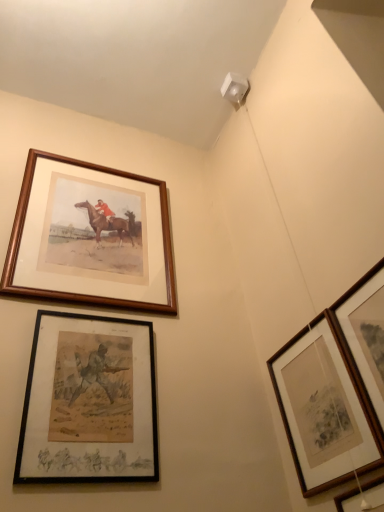
What do you see at coordinates (365, 335) in the screenshot?
I see `wooden picture frame at upper right, marked as the fifth picture frame in a left-to-right arrangement` at bounding box center [365, 335].

Image resolution: width=384 pixels, height=512 pixels. Describe the element at coordinates (348, 499) in the screenshot. I see `wooden picture frame at lower right, arranged as the second picture frame when viewed from the right` at that location.

What is the approximate width of wooden framed print at lower right, which is the third picture frame in right-to-left order?

It is 1.67 inches.

Image resolution: width=384 pixels, height=512 pixels. What are the coordinates of `black matte picture frame at lower left, which is the 2th picture frame from left to right` in the screenshot? It's located at (89, 402).

Considering the sizes of objects wooden framed print at lower right, which appears as the 3th picture frame when viewed from the left, and wooden picture frame at lower right, the 4th picture frame viewed from the left, in the image provided, who is thinner, wooden framed print at lower right, which appears as the 3th picture frame when viewed from the left, or wooden picture frame at lower right, the 4th picture frame viewed from the left,?

Thinner between the two is wooden framed print at lower right, which appears as the 3th picture frame when viewed from the left.

Is wooden framed print at lower right, which appears as the 3th picture frame when viewed from the left, facing away from wooden picture frame at lower right, the 4th picture frame viewed from the left?

wooden framed print at lower right, which appears as the 3th picture frame when viewed from the left, is not turned away from wooden picture frame at lower right, the 4th picture frame viewed from the left.

Does wooden framed print at lower right, which is the third picture frame in right-to-left order, have a lesser height compared to wooden picture frame at lower right, arranged as the second picture frame when viewed from the right?

No, wooden framed print at lower right, which is the third picture frame in right-to-left order, is not shorter than wooden picture frame at lower right, arranged as the second picture frame when viewed from the right.

Is wooden picture frame at lower right, the 4th picture frame viewed from the left, oriented away from wooden picture frame at upper right, marked as the fifth picture frame in a left-to-right arrangement?

That's not correct — wooden picture frame at lower right, the 4th picture frame viewed from the left, is not looking away from wooden picture frame at upper right, marked as the fifth picture frame in a left-to-right arrangement.

This screenshot has width=384, height=512. I want to click on picture frame below the wooden picture frame at upper right, marked as the first picture frame in a right-to-left arrangement (from a real-world perspective), so click(348, 499).

Does point (379, 502) come farther from viewer compared to point (378, 406)?

That is False.

From the image's perspective, which object appears higher, wooden picture frame at lower right, the 4th picture frame viewed from the left, or wooden picture frame at upper right, marked as the fifth picture frame in a left-to-right arrangement?

wooden picture frame at upper right, marked as the fifth picture frame in a left-to-right arrangement.

Is wooden picture frame at lower right, arranged as the second picture frame when viewed from the right, thinner than black matte picture frame at lower left, which is the 2th picture frame from left to right?

No, wooden picture frame at lower right, arranged as the second picture frame when viewed from the right, is not thinner than black matte picture frame at lower left, which is the 2th picture frame from left to right.

In the scene shown: Does wooden picture frame at lower right, the 4th picture frame viewed from the left, have a smaller size compared to black matte picture frame at lower left, which ranks as the 4th picture frame in right-to-left order?

Actually, wooden picture frame at lower right, the 4th picture frame viewed from the left, might be larger than black matte picture frame at lower left, which ranks as the 4th picture frame in right-to-left order.

Is wooden picture frame at lower right, the 4th picture frame viewed from the left, far from black matte picture frame at lower left, which is the 2th picture frame from left to right?

No, wooden picture frame at lower right, the 4th picture frame viewed from the left, is in close proximity to black matte picture frame at lower left, which is the 2th picture frame from left to right.

Is wooden picture frame at lower right, arranged as the second picture frame when viewed from the right, oriented away from black matte picture frame at lower left, which ranks as the 4th picture frame in right-to-left order?

wooden picture frame at lower right, arranged as the second picture frame when viewed from the right, is not turned away from black matte picture frame at lower left, which ranks as the 4th picture frame in right-to-left order.

Which point is more distant from viewer, [343,435] or [69,211]?

The point [69,211] is farther from the camera.

Considering their positions, is wooden framed print at lower right, which appears as the 3th picture frame when viewed from the left, located in front of or behind wooden frame at upper left, the fifth picture frame in the right-to-left sequence?

Clearly, wooden framed print at lower right, which appears as the 3th picture frame when viewed from the left, is in front of wooden frame at upper left, the fifth picture frame in the right-to-left sequence.

Which picture frame is the 2nd one when counting from the back of the wooden framed print at lower right, which appears as the 3th picture frame when viewed from the left? Please provide its 2D coordinates.

[(90, 237)]

Is wooden framed print at lower right, which is the third picture frame in right-to-left order, spatially inside wooden frame at upper left, which appears as the first picture frame when viewed from the left, or outside of it?

wooden framed print at lower right, which is the third picture frame in right-to-left order, is outside wooden frame at upper left, which appears as the first picture frame when viewed from the left.

Considering the points (351, 347) and (132, 226), which point is in front, point (351, 347) or point (132, 226)?

The point (351, 347) is in front.

Could you tell me if wooden picture frame at upper right, marked as the first picture frame in a right-to-left arrangement, is turned towards wooden frame at upper left, which appears as the first picture frame when viewed from the left?

No, wooden picture frame at upper right, marked as the first picture frame in a right-to-left arrangement, is not oriented towards wooden frame at upper left, which appears as the first picture frame when viewed from the left.

From the image's perspective, would you say wooden picture frame at upper right, marked as the fifth picture frame in a left-to-right arrangement, is shown under wooden frame at upper left, which appears as the first picture frame when viewed from the left?

Indeed, from the image's perspective, wooden picture frame at upper right, marked as the fifth picture frame in a left-to-right arrangement, is shown beneath wooden frame at upper left, which appears as the first picture frame when viewed from the left.

Find the location of `picture frame that is the 3rd object located in front of the wooden frame at upper left, which appears as the first picture frame when viewed from the left`. picture frame that is the 3rd object located in front of the wooden frame at upper left, which appears as the first picture frame when viewed from the left is located at coordinates (365, 335).

Which point is more distant from viewer, (356, 497) or (281, 378)?

The point (281, 378) is behind.

Looking at their sizes, would you say wooden picture frame at lower right, the 4th picture frame viewed from the left, is wider or thinner than wooden framed print at lower right, which is the third picture frame in right-to-left order?

In the image, wooden picture frame at lower right, the 4th picture frame viewed from the left, appears to be wider than wooden framed print at lower right, which is the third picture frame in right-to-left order.

From a real-world perspective, who is located higher, wooden picture frame at lower right, the 4th picture frame viewed from the left, or wooden framed print at lower right, which is the third picture frame in right-to-left order?

wooden framed print at lower right, which is the third picture frame in right-to-left order, is physically above.

Considering the relative sizes of wooden picture frame at lower right, arranged as the second picture frame when viewed from the right, and wooden framed print at lower right, which is the third picture frame in right-to-left order, in the image provided, is wooden picture frame at lower right, arranged as the second picture frame when viewed from the right, taller than wooden framed print at lower right, which is the third picture frame in right-to-left order,?

In fact, wooden picture frame at lower right, arranged as the second picture frame when viewed from the right, may be shorter than wooden framed print at lower right, which is the third picture frame in right-to-left order.

From the image's perspective, is wooden picture frame at upper right, marked as the first picture frame in a right-to-left arrangement, above wooden picture frame at lower right, arranged as the second picture frame when viewed from the right?

Indeed, from the image's perspective, wooden picture frame at upper right, marked as the first picture frame in a right-to-left arrangement, is shown above wooden picture frame at lower right, arranged as the second picture frame when viewed from the right.

Which of these two, wooden picture frame at upper right, marked as the fifth picture frame in a left-to-right arrangement, or wooden picture frame at lower right, the 4th picture frame viewed from the left, is smaller?

wooden picture frame at upper right, marked as the fifth picture frame in a left-to-right arrangement.

At what (x,y) coordinates should I click in order to perform the action: click on the 1st picture frame directly above the wooden picture frame at lower right, the 4th picture frame viewed from the left (from a real-world perspective). Please return your answer as a coordinate pair (x, y). Looking at the image, I should click on (365, 335).

Would you say wooden picture frame at upper right, marked as the fifth picture frame in a left-to-right arrangement, is inside or outside wooden picture frame at lower right, arranged as the second picture frame when viewed from the right?

Result: wooden picture frame at upper right, marked as the fifth picture frame in a left-to-right arrangement, is outside wooden picture frame at lower right, arranged as the second picture frame when viewed from the right.

The image size is (384, 512). Find the location of `picture frame below the wooden framed print at lower right, which is the third picture frame in right-to-left order (from the image's perspective)`. picture frame below the wooden framed print at lower right, which is the third picture frame in right-to-left order (from the image's perspective) is located at coordinates (348, 499).

Starting from the wooden picture frame at upper right, marked as the first picture frame in a right-to-left arrangement, which picture frame is the 1st one to the left? Please provide its 2D coordinates.

[(348, 499)]

Based on their spatial positions, is black matte picture frame at lower left, which is the 2th picture frame from left to right, or wooden framed print at lower right, which appears as the 3th picture frame when viewed from the left, closer to wooden picture frame at upper right, marked as the first picture frame in a right-to-left arrangement?

Among the two, wooden framed print at lower right, which appears as the 3th picture frame when viewed from the left, is located nearer to wooden picture frame at upper right, marked as the first picture frame in a right-to-left arrangement.

Based on their spatial positions, is wooden frame at upper left, which appears as the first picture frame when viewed from the left, or wooden picture frame at lower right, arranged as the second picture frame when viewed from the right, further from black matte picture frame at lower left, which is the 2th picture frame from left to right?

wooden picture frame at lower right, arranged as the second picture frame when viewed from the right.

Considering their positions, is wooden picture frame at upper right, marked as the first picture frame in a right-to-left arrangement, positioned closer to wooden framed print at lower right, which appears as the 3th picture frame when viewed from the left, than black matte picture frame at lower left, which ranks as the 4th picture frame in right-to-left order?

The object closer to wooden framed print at lower right, which appears as the 3th picture frame when viewed from the left, is wooden picture frame at upper right, marked as the first picture frame in a right-to-left arrangement.

Estimate the real-world distances between objects in this image. Which object is closer to wooden framed print at lower right, which is the third picture frame in right-to-left order, black matte picture frame at lower left, which is the 2th picture frame from left to right, or wooden picture frame at lower right, the 4th picture frame viewed from the left?

Based on the image, wooden picture frame at lower right, the 4th picture frame viewed from the left, appears to be nearer to wooden framed print at lower right, which is the third picture frame in right-to-left order.

Estimate the real-world distances between objects in this image. Which object is closer to wooden frame at upper left, which appears as the first picture frame when viewed from the left, wooden framed print at lower right, which appears as the 3th picture frame when viewed from the left, or black matte picture frame at lower left, which ranks as the 4th picture frame in right-to-left order?

black matte picture frame at lower left, which ranks as the 4th picture frame in right-to-left order, is positioned closer to the anchor wooden frame at upper left, which appears as the first picture frame when viewed from the left.

Considering their positions, is wooden picture frame at upper right, marked as the first picture frame in a right-to-left arrangement, positioned further to black matte picture frame at lower left, which is the 2th picture frame from left to right, than wooden framed print at lower right, which appears as the 3th picture frame when viewed from the left?

wooden picture frame at upper right, marked as the first picture frame in a right-to-left arrangement.

From the picture: Looking at the image, which one is located further to wooden picture frame at lower right, arranged as the second picture frame when viewed from the right, wooden picture frame at upper right, marked as the first picture frame in a right-to-left arrangement, or wooden frame at upper left, the fifth picture frame in the right-to-left sequence?

wooden frame at upper left, the fifth picture frame in the right-to-left sequence, is further to wooden picture frame at lower right, arranged as the second picture frame when viewed from the right.

When comparing their distances from wooden picture frame at lower right, arranged as the second picture frame when viewed from the right, does black matte picture frame at lower left, which ranks as the 4th picture frame in right-to-left order, or wooden framed print at lower right, which appears as the 3th picture frame when viewed from the left, seem closer?

wooden framed print at lower right, which appears as the 3th picture frame when viewed from the left.

I want to click on picture frame between black matte picture frame at lower left, which ranks as the 4th picture frame in right-to-left order, and wooden picture frame at lower right, the 4th picture frame viewed from the left, in the horizontal direction, so click(323, 409).

This screenshot has width=384, height=512. I want to click on picture frame located between wooden frame at upper left, the fifth picture frame in the right-to-left sequence, and wooden framed print at lower right, which is the third picture frame in right-to-left order, in the left-right direction, so click(x=89, y=402).